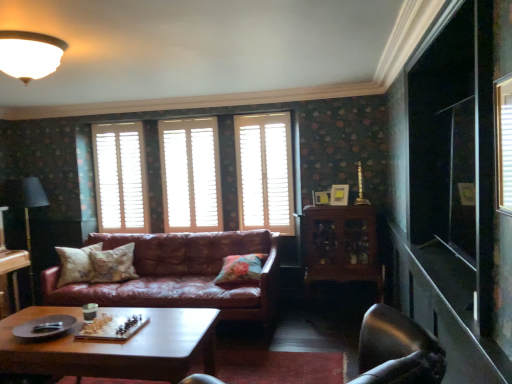
Where is `free space in front of matte gold picture frame at upper center, which is the second picture frame from left to right`? free space in front of matte gold picture frame at upper center, which is the second picture frame from left to right is located at coordinates click(343, 210).